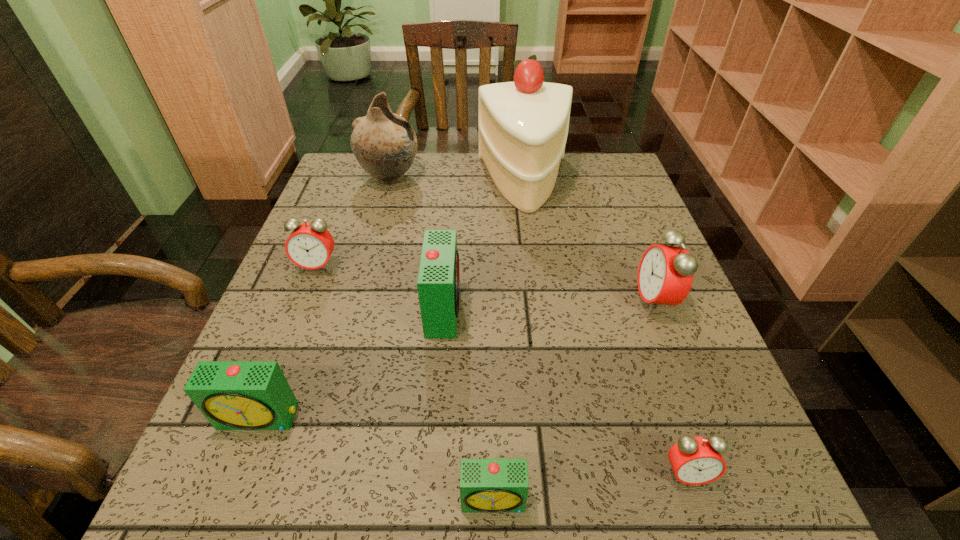
Identify the location of the smallest green alarm clock. The height and width of the screenshot is (540, 960). (486, 485).

The width and height of the screenshot is (960, 540). Identify the location of the third alarm clock from right to left. (486, 485).

Where is `free space located 0.230m on the left of the tallest object`? Image resolution: width=960 pixels, height=540 pixels. free space located 0.230m on the left of the tallest object is located at coordinates (394, 183).

What are the coordinates of `blank space located 0.190m from the spout of the pottery` in the screenshot? It's located at (490, 178).

Locate an element on the screen. The image size is (960, 540). vacant space positioned on the front-facing side of the second nearest red alarm clock is located at coordinates (567, 302).

You are a GUI agent. You are given a task and a screenshot of the screen. Output one action in this format:
    pyautogui.click(x=<x>, y=<y>)
    Task: Click on the free location located 0.160m on the front-facing side of the second nearest red alarm clock
    
    Given the screenshot: What is the action you would take?
    pyautogui.click(x=557, y=302)

This screenshot has width=960, height=540. I want to click on vacant area situated 0.180m on the front-facing side of the second nearest red alarm clock, so click(x=547, y=302).

This screenshot has width=960, height=540. Find the location of `free space located 0.150m on the front-facing side of the second green alarm clock from right to left`. free space located 0.150m on the front-facing side of the second green alarm clock from right to left is located at coordinates (536, 308).

Where is `vacant area situated 0.380m on the front-facing side of the sixth nearest object`? This screenshot has height=540, width=960. vacant area situated 0.380m on the front-facing side of the sixth nearest object is located at coordinates (246, 450).

The height and width of the screenshot is (540, 960). Find the location of `vacant area situated 0.050m on the front-facing side of the nearest red alarm clock`. vacant area situated 0.050m on the front-facing side of the nearest red alarm clock is located at coordinates (704, 528).